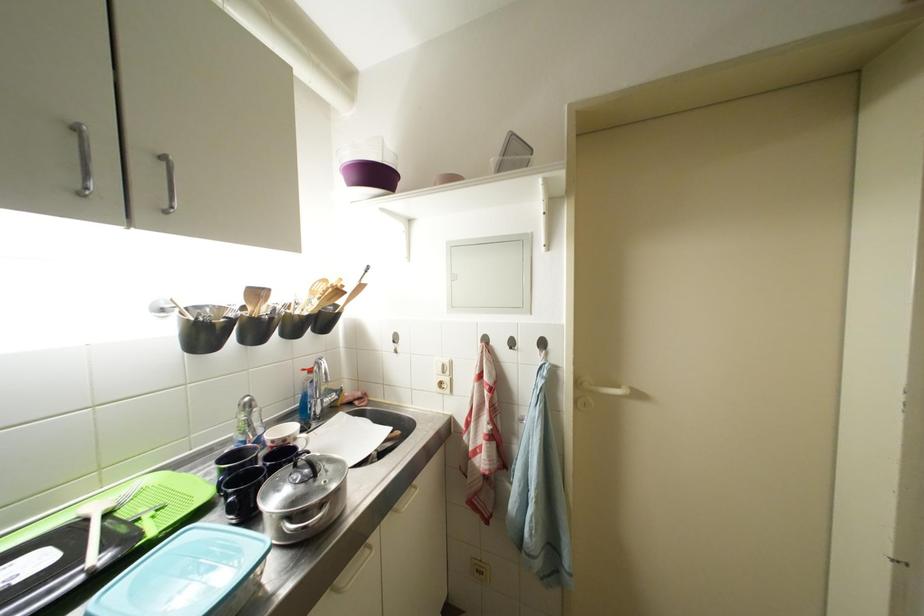
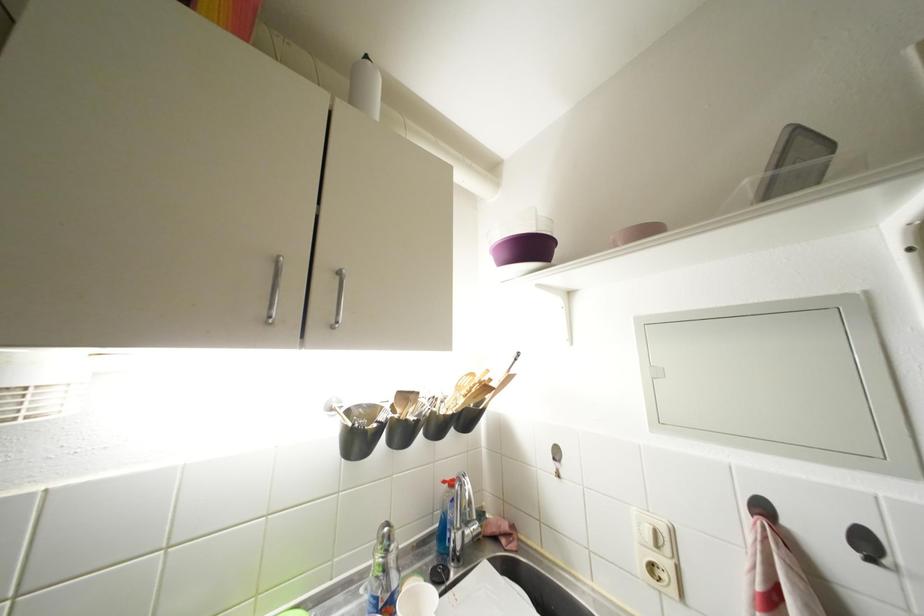
Locate, in the second image, the point that corresponds to (x=517, y=353) in the first image.

(877, 565)